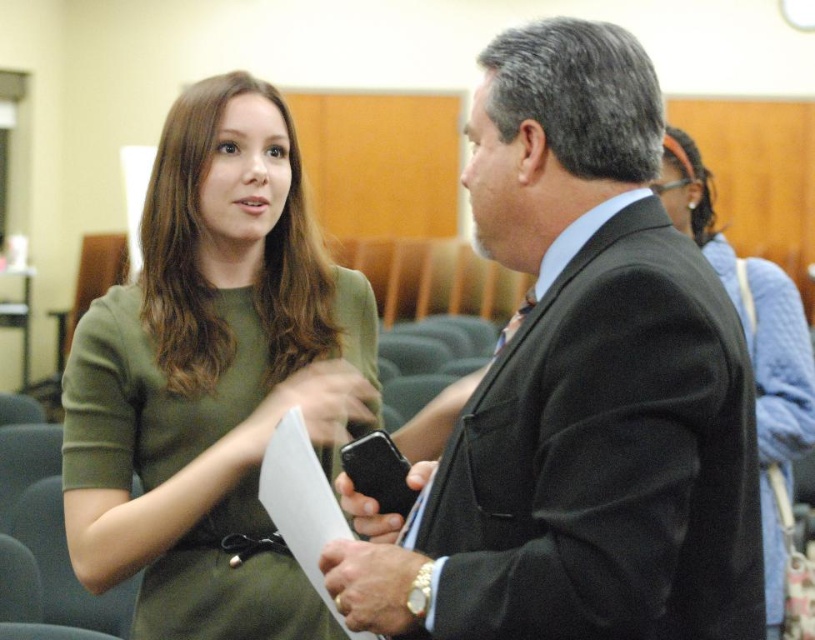
Who is shorter, green matte dress at upper left or blue textured sweater at upper right?

green matte dress at upper left is shorter.

Between green matte dress at upper left and blue textured sweater at upper right, which one has more height?

Standing taller between the two is blue textured sweater at upper right.

Is point (206, 442) behind point (725, 262)?

No, it is in front of (725, 262).

The height and width of the screenshot is (640, 815). Find the location of `green matte dress at upper left`. green matte dress at upper left is located at coordinates (212, 378).

Can you confirm if matte black suit at center is taller than green matte dress at upper left?

In fact, matte black suit at center may be shorter than green matte dress at upper left.

Can you confirm if matte black suit at center is shorter than green matte dress at upper left?

Indeed, matte black suit at center has a lesser height compared to green matte dress at upper left.

What do you see at coordinates (578, 390) in the screenshot? This screenshot has height=640, width=815. I see `matte black suit at center` at bounding box center [578, 390].

Find the location of a particular element. This screenshot has height=640, width=815. matte black suit at center is located at coordinates (578, 390).

Does matte black suit at center have a greater height compared to blue textured sweater at upper right?

In fact, matte black suit at center may be shorter than blue textured sweater at upper right.

Describe the element at coordinates (578, 390) in the screenshot. The height and width of the screenshot is (640, 815). I see `matte black suit at center` at that location.

The width and height of the screenshot is (815, 640). I want to click on matte black suit at center, so click(578, 390).